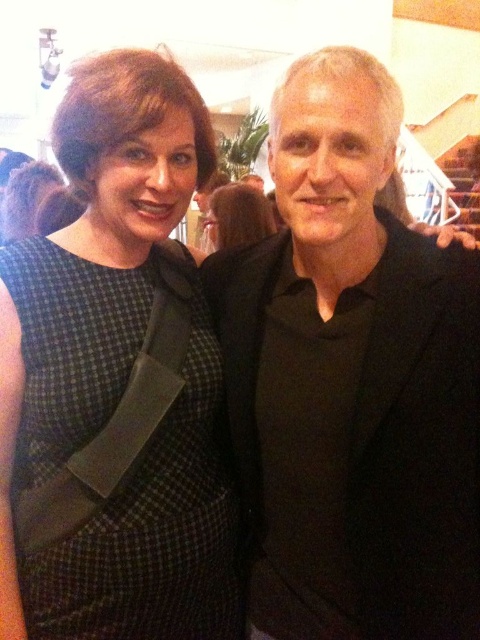
Question: Can you confirm if black matte suit at center is positioned above green checkered dress at left?

Choices:
 (A) yes
 (B) no

Answer: (A)

Question: Among these points, which one is farthest from the camera?

Choices:
 (A) (286, 538)
 (B) (232, 227)
 (C) (192, 529)

Answer: (B)

Question: Does black matte suit at center have a lesser width compared to dark brown hair at center?

Choices:
 (A) yes
 (B) no

Answer: (B)

Question: Among these points, which one is nearest to the camera?

Choices:
 (A) (166, 426)
 (B) (240, 202)
 (C) (396, 628)

Answer: (C)

Question: Based on their relative distances, which object is nearer to the black matte suit at center?

Choices:
 (A) dark brown hair at center
 (B) green checkered dress at left

Answer: (B)

Question: Does black matte suit at center appear under green checkered dress at left?

Choices:
 (A) no
 (B) yes

Answer: (A)